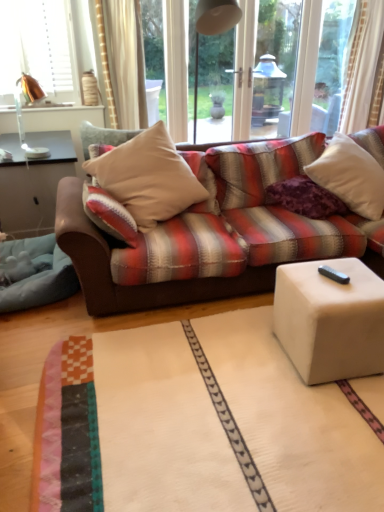
Where is `vacant space situated on the left part of black plastic remote control at lower right`? The image size is (384, 512). vacant space situated on the left part of black plastic remote control at lower right is located at coordinates tap(310, 276).